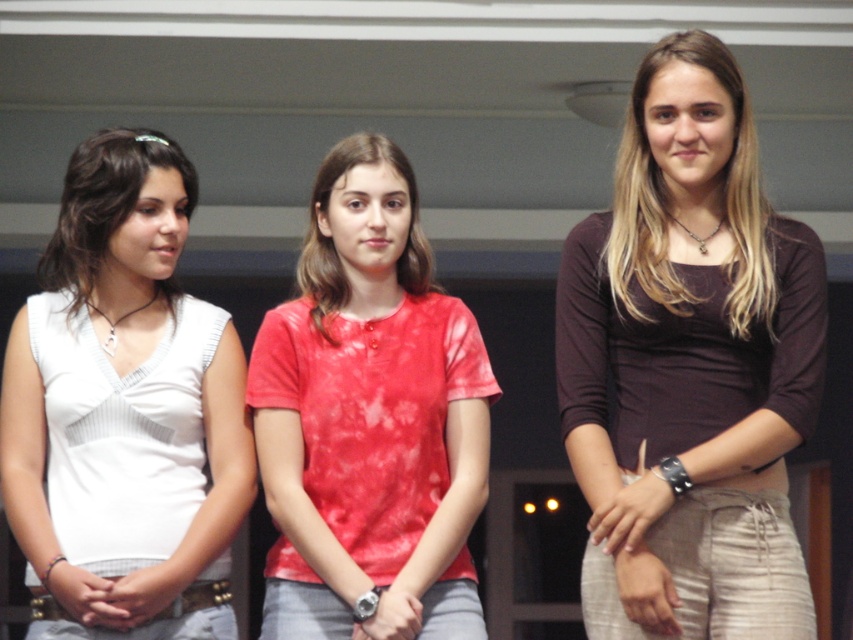
Does brown matte shirt at center have a lesser height compared to matte white blouse at left?

In fact, brown matte shirt at center may be taller than matte white blouse at left.

What do you see at coordinates (689, 365) in the screenshot? I see `brown matte shirt at center` at bounding box center [689, 365].

Between point (753, 592) and point (53, 243), which one is positioned behind?

The point (53, 243) is behind.

Where is `brown matte shirt at center`? The image size is (853, 640). brown matte shirt at center is located at coordinates (689, 365).

Does white matte tank top at left have a smaller size compared to brown matte shirt at right?

No, white matte tank top at left is not smaller than brown matte shirt at right.

Consider the image. Between white matte tank top at left and brown matte shirt at right, which one appears on the left side from the viewer's perspective?

white matte tank top at left is more to the left.

Identify the location of white matte tank top at left. The height and width of the screenshot is (640, 853). (126, 381).

Looking at this image, is the position of red tie-dye t-shirt at center less distant than that of red tie-dye shirt at center?

Yes.

Who is higher up, red tie-dye t-shirt at center or red tie-dye shirt at center?

Positioned higher is red tie-dye shirt at center.

Measure the distance between red tie-dye t-shirt at center and camera.

red tie-dye t-shirt at center and camera are 4.09 meters apart from each other.

Find the location of a particular element. This screenshot has height=640, width=853. red tie-dye t-shirt at center is located at coordinates (370, 417).